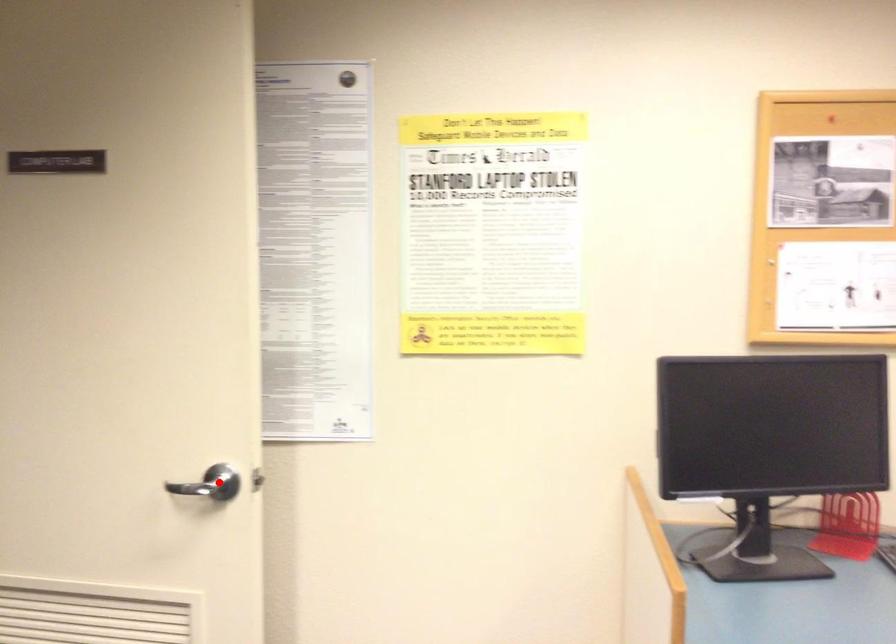
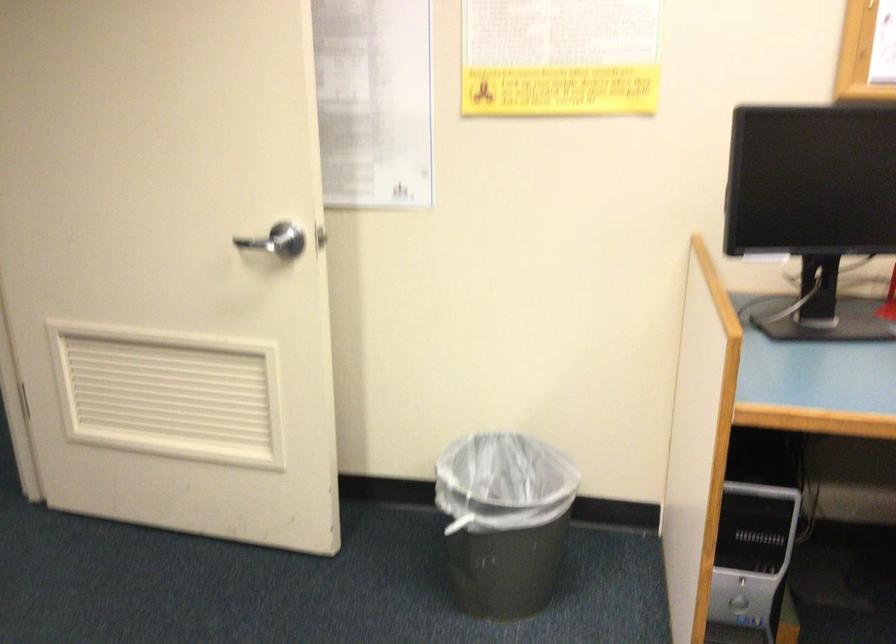
The point at the highlighted location is marked in the first image. Where is the corresponding point in the second image?

(286, 240)